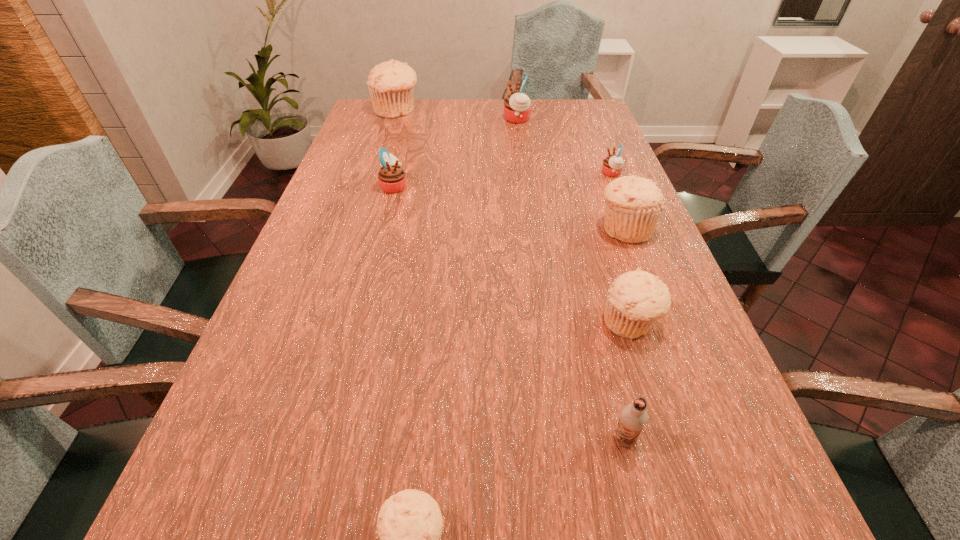
Find the location of a particular element. free space between the smallest pink muffin and the leftmost pink muffin is located at coordinates [503, 180].

Find the location of `empty space between the leftmost pink muffin and the smallest pink muffin`. empty space between the leftmost pink muffin and the smallest pink muffin is located at coordinates (503, 180).

Locate an element on the screen. vacant region between the leftmost pink muffin and the second farthest beige muffin is located at coordinates (510, 207).

Identify which object is the second nearest to the farthest pink muffin. Please provide its 2D coordinates. Your answer should be formatted as a tuple, i.e. [(x, y)], where the tuple contains the x and y coordinates of a point satisfying the conditions above.

[(612, 166)]

Where is `object that is the sixth nearest to the leftmost pink muffin`? The image size is (960, 540). object that is the sixth nearest to the leftmost pink muffin is located at coordinates (633, 417).

Point out which muffin is positioned as the seventh nearest to the second nearest object. Please provide its 2D coordinates. Your answer should be formatted as a tuple, i.e. [(x, y)], where the tuple contains the x and y coordinates of a point satisfying the conditions above.

[(391, 84)]

Identify which muffin is located as the second nearest to the nearest object. Please provide its 2D coordinates. Your answer should be formatted as a tuple, i.e. [(x, y)], where the tuple contains the x and y coordinates of a point satisfying the conditions above.

[(634, 205)]

At what (x,y) coordinates should I click in order to perform the action: click on beige muffin that is the closest to the smallest pink muffin. Please return your answer as a coordinate pair (x, y). The image size is (960, 540). Looking at the image, I should click on (634, 205).

You are a GUI agent. You are given a task and a screenshot of the screen. Output one action in this format:
    pyautogui.click(x=<x>, y=<y>)
    Task: Click on the beige muffin that is the third closest to the second smallest beige muffin
    
    Given the screenshot: What is the action you would take?
    pyautogui.click(x=391, y=84)

Select which pink muffin is the closest to the chocolate milk. Please provide its 2D coordinates. Your answer should be formatted as a tuple, i.e. [(x, y)], where the tuple contains the x and y coordinates of a point satisfying the conditions above.

[(612, 166)]